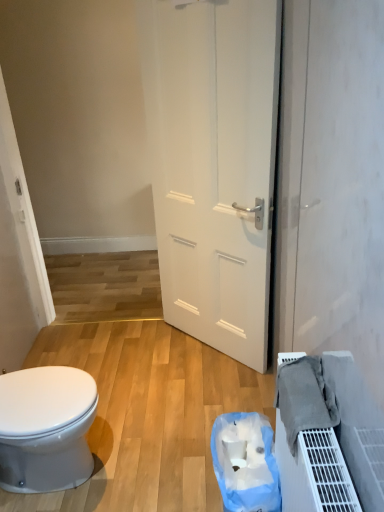
Question: From the image's perspective, is gray fabric at lower right beneath white glossy bidet at lower left?

Choices:
 (A) no
 (B) yes

Answer: (A)

Question: Considering the relative sizes of gray fabric at lower right and white glossy bidet at lower left in the image provided, is gray fabric at lower right taller than white glossy bidet at lower left?

Choices:
 (A) no
 (B) yes

Answer: (A)

Question: Considering the relative sizes of gray fabric at lower right and white glossy bidet at lower left in the image provided, is gray fabric at lower right shorter than white glossy bidet at lower left?

Choices:
 (A) no
 (B) yes

Answer: (B)

Question: Can you confirm if gray fabric at lower right is positioned to the left of white glossy bidet at lower left?

Choices:
 (A) no
 (B) yes

Answer: (A)

Question: Is gray fabric at lower right wider than white glossy bidet at lower left?

Choices:
 (A) yes
 (B) no

Answer: (B)

Question: Is gray fabric at lower right outside of white glossy bidet at lower left?

Choices:
 (A) no
 (B) yes

Answer: (B)

Question: Can you confirm if blue plastic bag at lower center is positioned to the right of white glossy bidet at lower left?

Choices:
 (A) no
 (B) yes

Answer: (B)

Question: Is blue plastic bag at lower center shorter than white glossy bidet at lower left?

Choices:
 (A) no
 (B) yes

Answer: (B)

Question: From a real-world perspective, is blue plastic bag at lower center physically above white glossy bidet at lower left?

Choices:
 (A) yes
 (B) no

Answer: (B)

Question: Is blue plastic bag at lower center smaller than white glossy bidet at lower left?

Choices:
 (A) yes
 (B) no

Answer: (A)

Question: Is white glossy bidet at lower left inside blue plastic bag at lower center?

Choices:
 (A) yes
 (B) no

Answer: (B)

Question: Can we say blue plastic bag at lower center lies outside white glossy bidet at lower left?

Choices:
 (A) no
 (B) yes

Answer: (B)

Question: Is white matte door at center closer to camera compared to blue plastic bag at lower center?

Choices:
 (A) no
 (B) yes

Answer: (A)